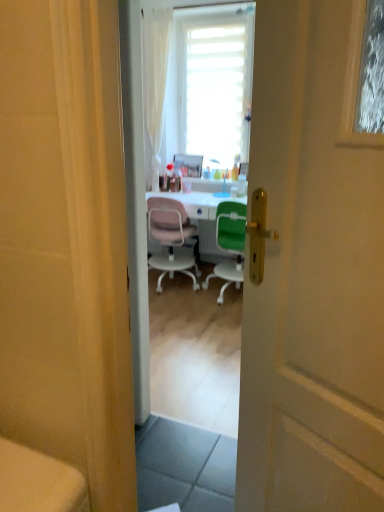
Describe the element at coordinates (189, 165) in the screenshot. I see `wooden picture frame at center` at that location.

The height and width of the screenshot is (512, 384). Describe the element at coordinates (229, 244) in the screenshot. I see `green plastic chair at center, the first chair positioned from the right` at that location.

What is the approximate height of white glossy desk at center?

white glossy desk at center is 31.93 inches in height.

The width and height of the screenshot is (384, 512). In order to click on pink plastic chair at center, which ranks as the second chair in right-to-left order in this screenshot , I will do `click(170, 238)`.

Where is `wooden picture frame at center`? wooden picture frame at center is located at coordinates (189, 165).

Considering the positions of objects white glossy desk at center and wooden picture frame at center in the image provided, who is behind, white glossy desk at center or wooden picture frame at center?

wooden picture frame at center is behind.

Is there a large distance between white glossy desk at center and wooden picture frame at center?

white glossy desk at center is actually quite close to wooden picture frame at center.

Who is taller, white glossy desk at center or wooden picture frame at center?

white glossy desk at center.

From the image's perspective, relative to wooden picture frame at center, is white glossy desk at center above or below?

white glossy desk at center is situated lower than wooden picture frame at center in the image.

Looking at this image, does white glossy desk at center have a lesser height compared to pink plastic chair at center, which ranks as the second chair in right-to-left order?

Yes.

Who is smaller, white glossy desk at center or pink plastic chair at center, which ranks as the second chair in right-to-left order?

Smaller between the two is pink plastic chair at center, which ranks as the second chair in right-to-left order.

Could you tell me if white glossy desk at center is turned towards pink plastic chair at center, which ranks as the second chair in right-to-left order?

Yes, white glossy desk at center faces towards pink plastic chair at center, which ranks as the second chair in right-to-left order.

Does point (185, 202) come closer to viewer compared to point (164, 243)?

No, (185, 202) is further to viewer.

From a real-world perspective, who is located lower, pink plastic chair at center, which ranks as the second chair in right-to-left order, or wooden picture frame at center?

pink plastic chair at center, which ranks as the second chair in right-to-left order, is physically lower.

Measure the distance between pink plastic chair at center, positioned as the first chair in left-to-right order, and wooden picture frame at center.

The distance of pink plastic chair at center, positioned as the first chair in left-to-right order, from wooden picture frame at center is 29.27 inches.

Is pink plastic chair at center, positioned as the first chair in left-to-right order, aimed at wooden picture frame at center?

Yes, pink plastic chair at center, positioned as the first chair in left-to-right order, is turned towards wooden picture frame at center.

Is pink plastic chair at center, which ranks as the second chair in right-to-left order, inside the boundaries of wooden picture frame at center, or outside?

pink plastic chair at center, which ranks as the second chair in right-to-left order, is not inside wooden picture frame at center, it's outside.

Which is more distant, (242, 243) or (157, 269)?

The point (157, 269) is more distant.

Between green plastic chair at center, the first chair positioned from the right, and pink plastic chair at center, positioned as the first chair in left-to-right order, which one is positioned in front?

green plastic chair at center, the first chair positioned from the right.

Is green plastic chair at center, the 2th chair positioned from the left, taller than pink plastic chair at center, which ranks as the second chair in right-to-left order?

No.

From the image's perspective, is pink plastic chair at center, positioned as the first chair in left-to-right order, above or below green plastic chair at center, the 2th chair positioned from the left?

pink plastic chair at center, positioned as the first chair in left-to-right order, is situated higher than green plastic chair at center, the 2th chair positioned from the left, in the image.

Which is more to the left, pink plastic chair at center, positioned as the first chair in left-to-right order, or green plastic chair at center, the first chair positioned from the right?

pink plastic chair at center, positioned as the first chair in left-to-right order.

The width and height of the screenshot is (384, 512). What are the coordinates of `chair above the green plastic chair at center, the 2th chair positioned from the left (from a real-world perspective)` in the screenshot? It's located at (170, 238).

Is pink plastic chair at center, which ranks as the second chair in right-to-left order, far away from green plastic chair at center, the first chair positioned from the right?

Actually, pink plastic chair at center, which ranks as the second chair in right-to-left order, and green plastic chair at center, the first chair positioned from the right, are a little close together.

Which object is further away from the camera taking this photo, green plastic chair at center, the first chair positioned from the right, or wooden picture frame at center?

wooden picture frame at center is more distant.

Does green plastic chair at center, the first chair positioned from the right, have a larger size compared to wooden picture frame at center?

Correct, green plastic chair at center, the first chair positioned from the right, is larger in size than wooden picture frame at center.

How many degrees apart are the facing directions of green plastic chair at center, the 2th chair positioned from the left, and wooden picture frame at center?

The angular difference between green plastic chair at center, the 2th chair positioned from the left, and wooden picture frame at center is 177 degrees.

Considering the relative positions of green plastic chair at center, the first chair positioned from the right, and wooden picture frame at center in the image provided, is green plastic chair at center, the first chair positioned from the right, to the left or to the right of wooden picture frame at center?

Clearly, green plastic chair at center, the first chair positioned from the right, is on the right of wooden picture frame at center in the image.

Is white matte door at center to the left or to the right of wooden picture frame at center in the image?

Clearly, white matte door at center is on the right of wooden picture frame at center in the image.

Considering their positions, is white matte door at center located in front of or behind wooden picture frame at center?

Visually, white matte door at center is located in front of wooden picture frame at center.

At what (x,y) coordinates should I click in order to perform the action: click on picture frame that appears on the left of white matte door at center. Please return your answer as a coordinate pair (x, y). Looking at the image, I should click on (189, 165).

Does white matte door at center turn towards wooden picture frame at center?

No.

What are the coordinates of `picture frame on the left of the white glossy desk at center` in the screenshot? It's located at 189,165.

Find the location of a particular element. This screenshot has height=512, width=384. chair that is the 1st object located in front of the white glossy desk at center is located at coordinates (170, 238).

Looking at the image, which one is located further to white glossy desk at center, white matte door at center or pink plastic chair at center, positioned as the first chair in left-to-right order?

Among the two, white matte door at center is located further to white glossy desk at center.

Looking at the image, which one is located closer to green plastic chair at center, the first chair positioned from the right, white glossy desk at center or wooden picture frame at center?

white glossy desk at center is positioned closer to the anchor green plastic chair at center, the first chair positioned from the right.

From the image, which object appears to be farther from wooden picture frame at center, green plastic chair at center, the first chair positioned from the right, or white glossy desk at center?

green plastic chair at center, the first chair positioned from the right.

Looking at the image, which one is located further to white glossy desk at center, white matte door at center or wooden picture frame at center?

white matte door at center is further to white glossy desk at center.

From the image, which object appears to be farther from green plastic chair at center, the 2th chair positioned from the left, wooden picture frame at center or pink plastic chair at center, which ranks as the second chair in right-to-left order?

wooden picture frame at center is further to green plastic chair at center, the 2th chair positioned from the left.

Looking at the image, which one is located closer to white matte door at center, green plastic chair at center, the 2th chair positioned from the left, or white glossy desk at center?

Among the two, green plastic chair at center, the 2th chair positioned from the left, is located nearer to white matte door at center.

Looking at the image, which one is located closer to green plastic chair at center, the first chair positioned from the right, pink plastic chair at center, which ranks as the second chair in right-to-left order, or white glossy desk at center?

white glossy desk at center is positioned closer to the anchor green plastic chair at center, the first chair positioned from the right.

From the image, which object appears to be farther from white matte door at center, white glossy desk at center or green plastic chair at center, the first chair positioned from the right?

Based on the image, white glossy desk at center appears to be further to white matte door at center.

Where is `chair located between green plastic chair at center, the first chair positioned from the right, and wooden picture frame at center in the depth direction`? The width and height of the screenshot is (384, 512). chair located between green plastic chair at center, the first chair positioned from the right, and wooden picture frame at center in the depth direction is located at coordinates (170, 238).

I want to click on desk between pink plastic chair at center, positioned as the first chair in left-to-right order, and green plastic chair at center, the first chair positioned from the right, from left to right, so click(203, 220).

Find the location of `desk between white matte door at center and wooden picture frame at center along the z-axis`. desk between white matte door at center and wooden picture frame at center along the z-axis is located at coordinates (203, 220).

Image resolution: width=384 pixels, height=512 pixels. I want to click on chair between white matte door at center and pink plastic chair at center, which ranks as the second chair in right-to-left order, from front to back, so click(x=229, y=244).